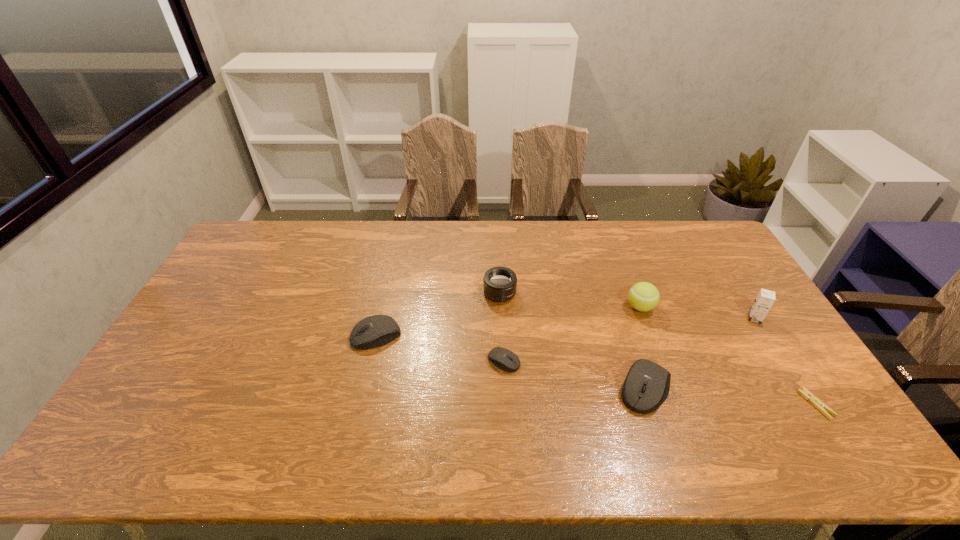
Image resolution: width=960 pixels, height=540 pixels. I want to click on object present at the near right corner, so click(x=818, y=404).

Where is `free space at the far edge of the desktop`? This screenshot has width=960, height=540. free space at the far edge of the desktop is located at coordinates (469, 246).

The width and height of the screenshot is (960, 540). Identify the location of vacant area at the near edge. (668, 419).

Locate an element on the screen. free space at the left edge of the desktop is located at coordinates (207, 376).

The width and height of the screenshot is (960, 540). In the image, there is a desktop. Find the location of `free space at the far left corner`. free space at the far left corner is located at coordinates (253, 234).

The height and width of the screenshot is (540, 960). Identify the location of free space at the far right corner of the desktop. pos(700,251).

Where is `vacant point located between the shortest object and the tennis ball`? The height and width of the screenshot is (540, 960). vacant point located between the shortest object and the tennis ball is located at coordinates (728, 356).

Identify the location of vacant space in between the telephoto lens and the chocolate milk. This screenshot has height=540, width=960. (627, 306).

The image size is (960, 540). I want to click on unoccupied position between the second computer equipment from left to right and the rightmost computer equipment, so click(575, 375).

Where is `free area in between the chocolate milk and the clothespin`? The height and width of the screenshot is (540, 960). free area in between the chocolate milk and the clothespin is located at coordinates (785, 361).